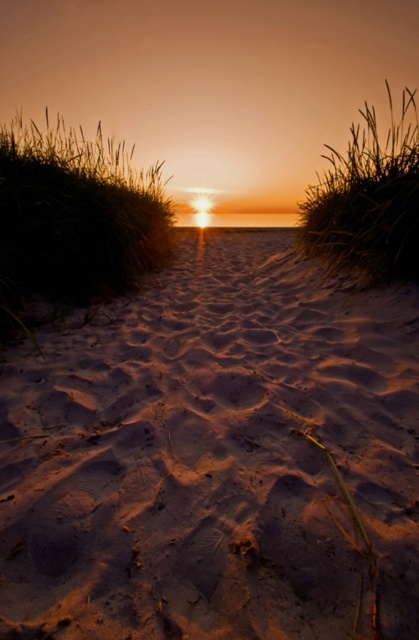
You are standing at the center of the sandy path in the beach scene. Looking towards the left side, you notice a specific location marked by coordinates. What object is located at point (74, 218)?

The point (74, 218) marks silvery grass at left.

You are standing on the sandy textured path at center and want to walk towards the silvery grass at upper right. Which direction should you head?

You should head to the right because the silvery grass at upper right is to the right of the sandy textured path at center.

You are a hiker trying to decide which path to take. You see the sandy textured path at center and the silvery grass at left. Which path is narrower?

The sandy textured path at center is narrower than the silvery grass at left because it has a lesser width.